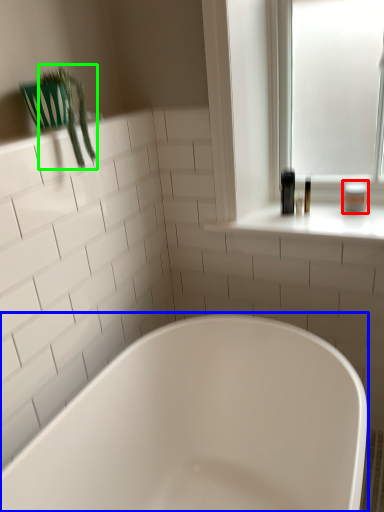
Question: Which object is positioned farthest from toiletry (highlighted by a red box)? Select from bathtub (highlighted by a blue box) and plant (highlighted by a green box).

Choices:
 (A) bathtub
 (B) plant

Answer: (B)